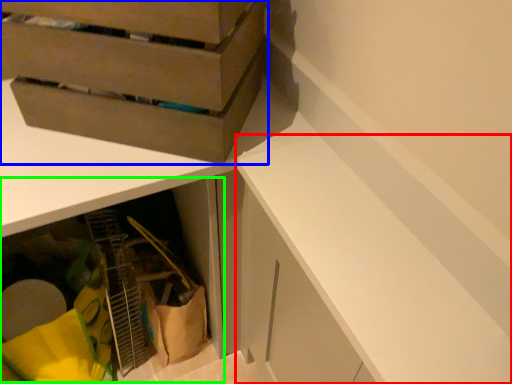
Question: Based on their relative distances, which object is nearer to cabinetry (highlighted by a red box)? Choose from cardboard box (highlighted by a blue box) and cabinetry (highlighted by a green box).

Choices:
 (A) cardboard box
 (B) cabinetry

Answer: (A)